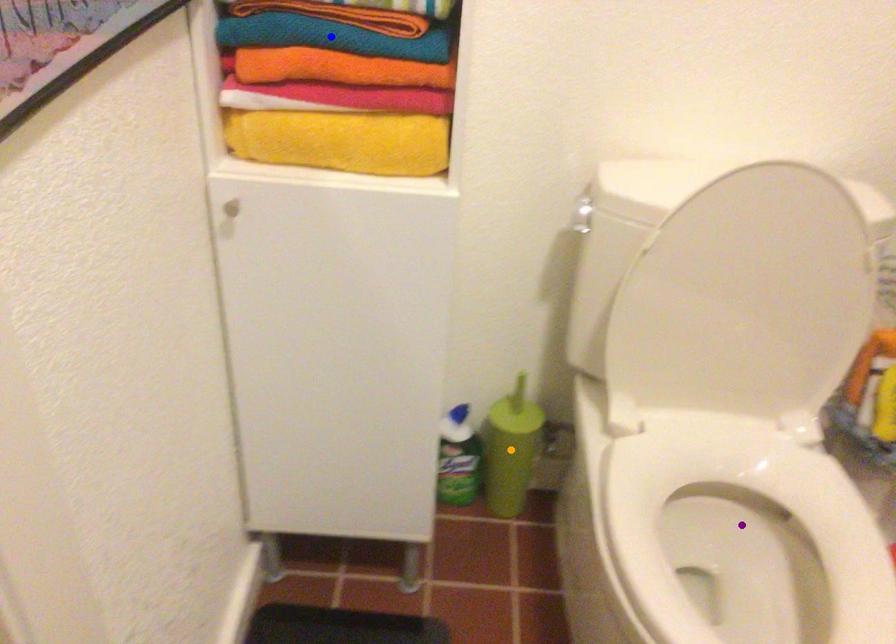
Order these from nearest to farthest:
A) purple point
B) orange point
C) blue point

orange point, purple point, blue point